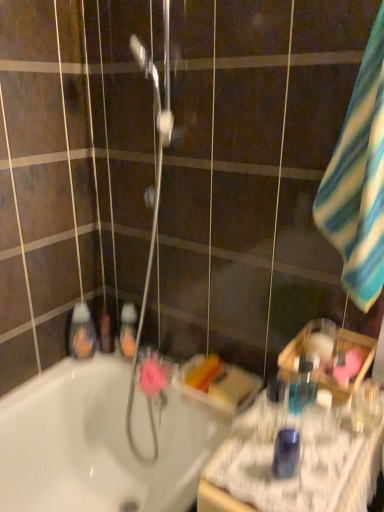
Question: Is translucent plastic mouthwash at left, the sixth mouthwash in the right-to-left sequence, to the left of translucent orange liquid at center, positioned as the third mouthwash in left-to-right order, from the viewer's perspective?

Choices:
 (A) yes
 (B) no

Answer: (A)

Question: From the image's perspective, is translucent plastic mouthwash at left, marked as the second mouthwash in a back-to-front arrangement, below translucent orange liquid at center, which is counted as the 4th mouthwash, starting from the front?

Choices:
 (A) no
 (B) yes

Answer: (A)

Question: Is translucent plastic mouthwash at left, the sixth mouthwash in the right-to-left sequence, far away from translucent orange liquid at center, which is counted as the 4th mouthwash, starting from the front?

Choices:
 (A) no
 (B) yes

Answer: (A)

Question: Can you confirm if translucent plastic mouthwash at left, marked as the second mouthwash in a back-to-front arrangement, is bigger than translucent orange liquid at center, positioned as the third mouthwash in left-to-right order?

Choices:
 (A) yes
 (B) no

Answer: (B)

Question: Is translucent plastic mouthwash at left, the sixth mouthwash in the right-to-left sequence, looking in the opposite direction of translucent orange liquid at center, the fourth mouthwash viewed from the right?

Choices:
 (A) no
 (B) yes

Answer: (A)

Question: Considering the relative sizes of translucent plastic mouthwash at left, the 5th mouthwash from the front, and translucent orange liquid at center, positioned as the third mouthwash in left-to-right order, in the image provided, is translucent plastic mouthwash at left, the 5th mouthwash from the front, smaller than translucent orange liquid at center, positioned as the third mouthwash in left-to-right order,?

Choices:
 (A) yes
 (B) no

Answer: (A)

Question: From the image's perspective, is clear plastic bottle at right, the 6th mouthwash in the left-to-right sequence, below translucent plastic mouthwash at lower left, acting as the sixth mouthwash starting from the front?

Choices:
 (A) yes
 (B) no

Answer: (A)

Question: Can you confirm if clear plastic bottle at right, the fifth mouthwash from the back, is shorter than translucent plastic mouthwash at lower left, acting as the sixth mouthwash starting from the front?

Choices:
 (A) no
 (B) yes

Answer: (B)

Question: Can you confirm if clear plastic bottle at right, marked as the second mouthwash in a front-to-back arrangement, is smaller than translucent plastic mouthwash at lower left, which is the fifth mouthwash in right-to-left order?

Choices:
 (A) yes
 (B) no

Answer: (A)

Question: Does clear plastic bottle at right, placed as the 1th mouthwash when sorted from right to left, have a larger size compared to translucent plastic mouthwash at lower left, acting as the sixth mouthwash starting from the front?

Choices:
 (A) no
 (B) yes

Answer: (A)

Question: Considering the relative sizes of clear plastic bottle at right, placed as the 1th mouthwash when sorted from right to left, and translucent plastic mouthwash at lower left, the 1th mouthwash in the back-to-front sequence, in the image provided, is clear plastic bottle at right, placed as the 1th mouthwash when sorted from right to left, taller than translucent plastic mouthwash at lower left, the 1th mouthwash in the back-to-front sequence,?

Choices:
 (A) yes
 (B) no

Answer: (B)

Question: Can you confirm if clear plastic bottle at right, the fifth mouthwash from the back, is positioned to the right of translucent plastic mouthwash at lower left, arranged as the 2th mouthwash when viewed from the left?

Choices:
 (A) yes
 (B) no

Answer: (A)

Question: From the image's perspective, is clear plastic bottle at right, the fifth mouthwash from the back, below translucent orange liquid at center, the fourth mouthwash viewed from the right?

Choices:
 (A) yes
 (B) no

Answer: (A)